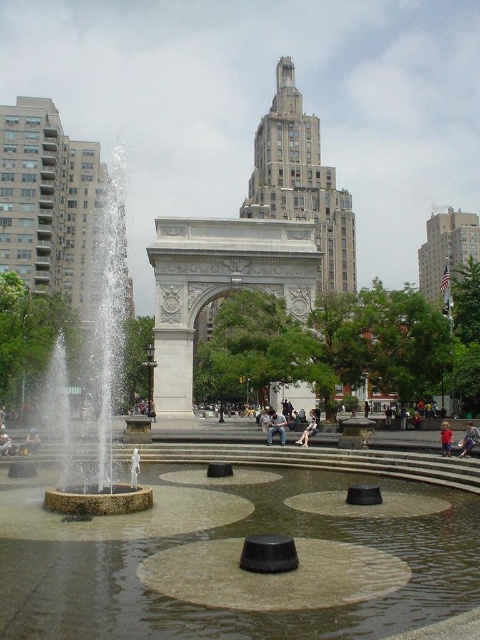
Is point (468, 422) in front of point (36, 449)?

That is False.

Does blue denim jeans at lower right appear under light blue denim jeans at lower left?

Actually, blue denim jeans at lower right is above light blue denim jeans at lower left.

Image resolution: width=480 pixels, height=640 pixels. In order to click on blue denim jeans at lower right in this screenshot , I will do `click(468, 440)`.

Measure the distance between point (314, 426) and camera.

182.96 feet

Consider the image. Between light brown leather jacket at center and light brown hair at lower right, which one has less height?

Standing shorter between the two is light brown leather jacket at center.

You are a GUI agent. You are given a task and a screenshot of the screen. Output one action in this format:
    pyautogui.click(x=<x>, y=<y>)
    Task: Click on the light brown leather jacket at center
    
    Given the screenshot: What is the action you would take?
    pyautogui.click(x=309, y=429)

I want to click on light brown leather jacket at center, so click(x=309, y=429).

Does white marble fountain at left have a greater height compared to denim jacket at center?

Correct, white marble fountain at left is much taller as denim jacket at center.

Which is behind, point (106, 442) or point (284, 433)?

The point (284, 433) is behind.

Where is `white marble fountain at left`? The width and height of the screenshot is (480, 640). white marble fountain at left is located at coordinates (104, 369).

Where is `white marble fountain at left`? This screenshot has height=640, width=480. white marble fountain at left is located at coordinates (104, 369).